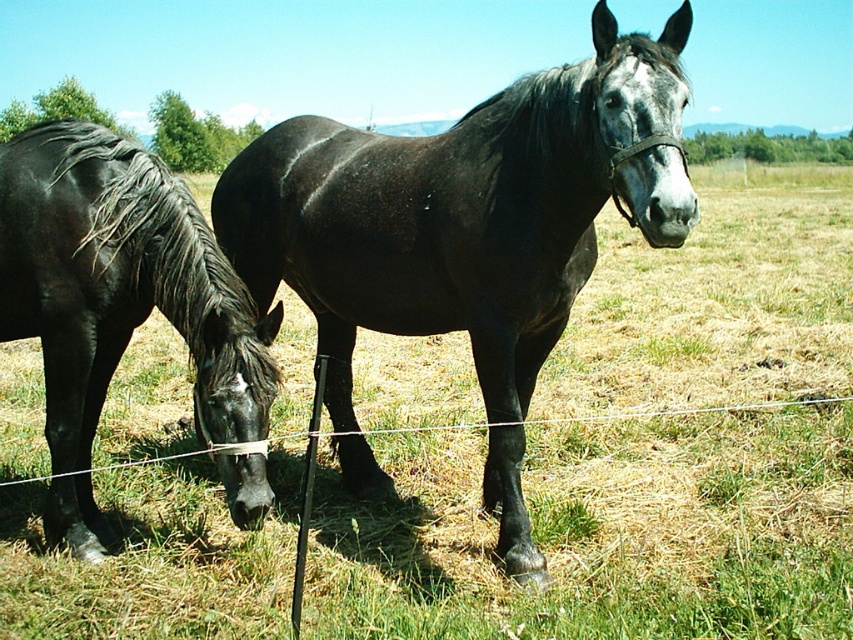
Between shiny black horse at center and black glossy horse at left, which one has more height?

shiny black horse at center

Is shiny black horse at center wider than black glossy horse at left?

Correct, the width of shiny black horse at center exceeds that of black glossy horse at left.

Which is in front, point (312, 260) or point (67, 353)?

Point (67, 353) is more forward.

This screenshot has height=640, width=853. I want to click on shiny black horse at center, so click(467, 227).